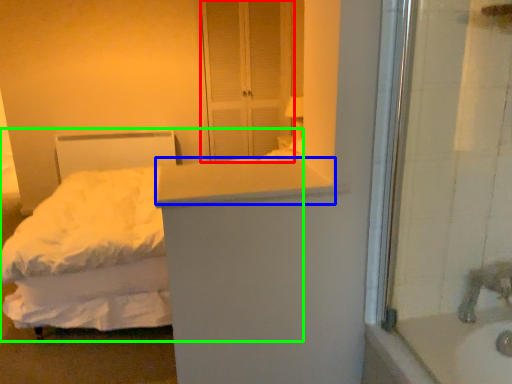
Question: Considering the real-world distances, which object is farthest from screen door (highlighted by a red box)? counter top (highlighted by a blue box) or bed (highlighted by a green box)?

Choices:
 (A) counter top
 (B) bed

Answer: (A)